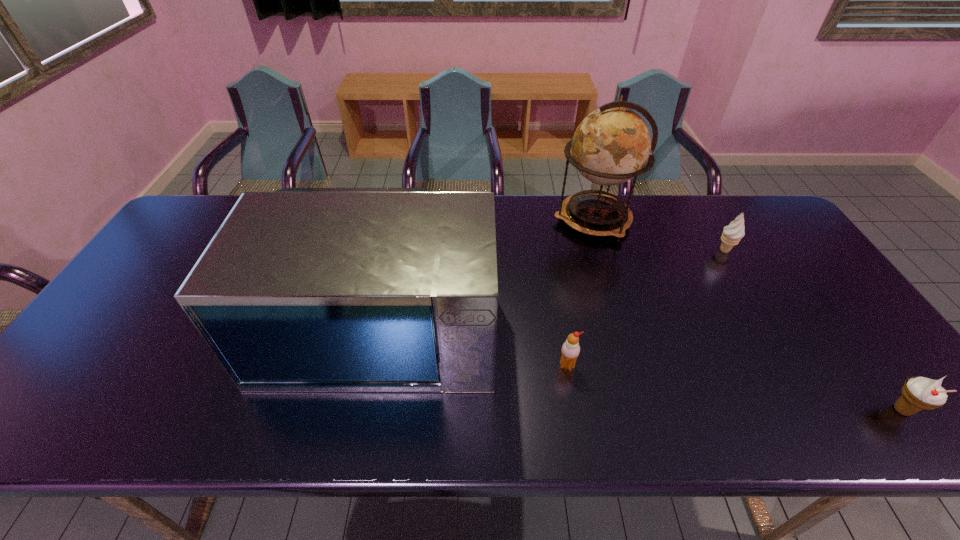
This screenshot has height=540, width=960. I want to click on vacant point located between the farthest icecream and the second tallest object, so click(x=553, y=286).

This screenshot has width=960, height=540. Find the location of `vacant area between the nearest object and the second object from left to right`. vacant area between the nearest object and the second object from left to right is located at coordinates (734, 388).

In order to click on unoccupied position between the rightmost object and the second tallest object in this screenshot , I will do `click(642, 366)`.

This screenshot has height=540, width=960. I want to click on unoccupied area between the fourth shortest object and the second icecream from left to right, so click(553, 286).

You are a GUI agent. You are given a task and a screenshot of the screen. Output one action in this format:
    pyautogui.click(x=<x>, y=<y>)
    Task: Click on the empty space that is in between the leftmost icecream and the globe
    
    Given the screenshot: What is the action you would take?
    pyautogui.click(x=580, y=293)

Locate an element on the screen. The height and width of the screenshot is (540, 960). free space between the nearest icecream and the tallest object is located at coordinates (748, 315).

Find the location of `empty space between the farthest icecream and the leftmost object`. empty space between the farthest icecream and the leftmost object is located at coordinates (553, 286).

Locate which object is the fourth closest to the rightmost icecream. Please provide its 2D coordinates. Your answer should be formatted as a tuple, i.e. [(x, y)], where the tuple contains the x and y coordinates of a point satisfying the conditions above.

[(302, 290)]

You are a GUI agent. You are given a task and a screenshot of the screen. Output one action in this format:
    pyautogui.click(x=<x>, y=<y>)
    Task: Click on the object that is the second closest one to the second icecream from right to left
    The image size is (960, 540).
    Given the screenshot: What is the action you would take?
    pyautogui.click(x=918, y=393)

Where is `the closest icecream to the second farthest icecream`? The width and height of the screenshot is (960, 540). the closest icecream to the second farthest icecream is located at coordinates (734, 232).